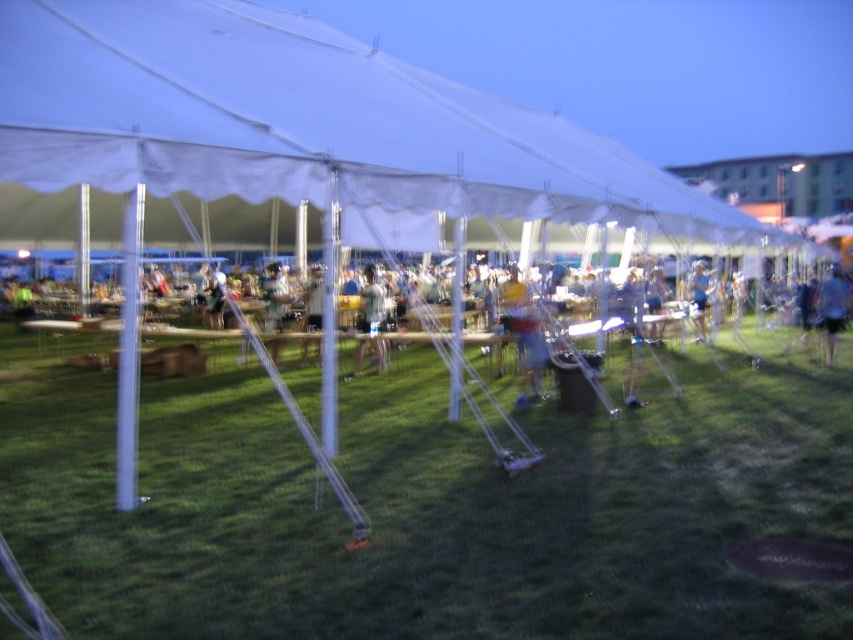
You are attending an outdoor event under a tent and notice two items in your view. The first is the white fabric canopy at upper center, and the second is the blue fabric shorts at lower right. Which of these two items is positioned higher in the scene?

The white fabric canopy at upper center is positioned higher than the blue fabric shorts at lower right.

You are at an outdoor event under the tents and need to find a place to sit. You see the white fabric canopy at upper center and the blue fabric shorts at lower right. Which object would you look under to find seating?

The white fabric canopy at upper center is larger in size than the blue fabric shorts at lower right, so seating is more likely under the white fabric canopy at upper center.

You are standing at the entrance of the tents and see two points marked in the image. Which point is closer to you? The points are labeled as point (357,365) and point (692,278).

Point (357,365) is in front of point (692,278), so it is closer to you.